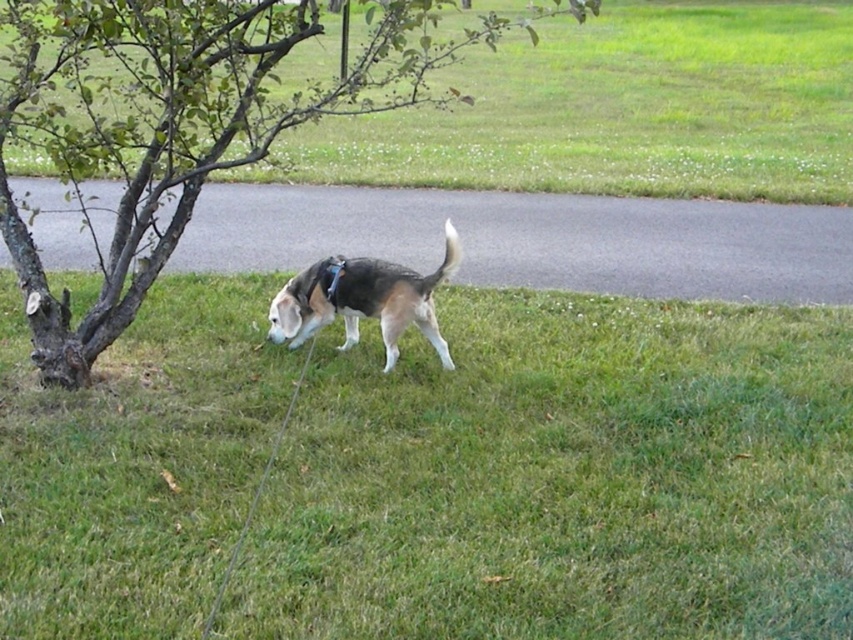
You are standing at the point labeled point (173, 122) and want to walk towards the beagle dog. Is the path clear or blocked by the small tree with thin branches and sparse green leaves?

The path from point (173, 122) to the beagle dog is blocked by the small tree with thin branches and sparse green leaves because the tree is located between them.

From the picture: You are standing in the grassy area near the paved road and see two points marked in the image. Which point is closer to you, point (26, 509) or point (335, 307)?

Point (26, 509) is closer to the viewer than point (335, 307).